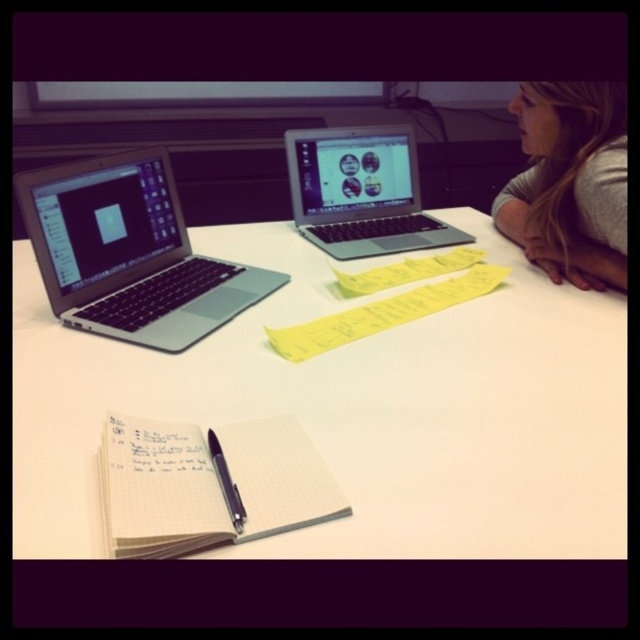
Question: Based on their relative distances, which object is nearer to the black metallic pen at center?

Choices:
 (A) silver metallic laptop at left
 (B) gray fabric hair at upper right

Answer: (A)

Question: Does silver metallic laptop at center appear under black metallic pen at center?

Choices:
 (A) yes
 (B) no

Answer: (B)

Question: Does white paper notebook at lower center come behind black metallic pen at center?

Choices:
 (A) yes
 (B) no

Answer: (B)

Question: Which of the following is the farthest from the observer?

Choices:
 (A) silver metallic laptop at center
 (B) white paper notebook at lower center
 (C) gray fabric hair at upper right

Answer: (A)

Question: Which is farther from the gray fabric hair at upper right?

Choices:
 (A) white paper notebook at lower center
 (B) black metallic pen at center
 (C) silver metallic laptop at center

Answer: (B)

Question: Can you confirm if white matte table at center is positioned above black metallic pen at center?

Choices:
 (A) no
 (B) yes

Answer: (B)